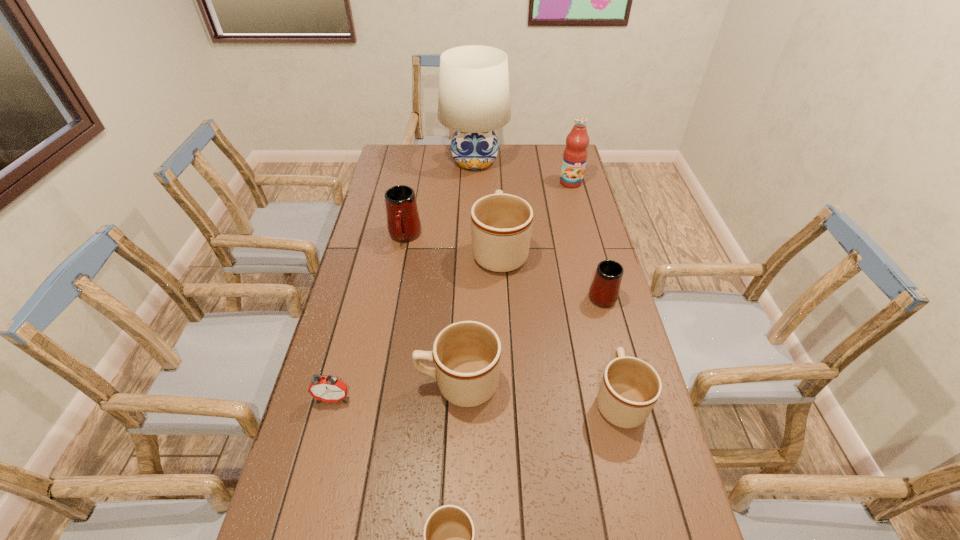
I want to click on alarm clock, so click(x=327, y=389).

Find the location of a particular element. vacant region located on the front-facing side of the tallest object is located at coordinates (474, 220).

In order to click on vacant space located 0.380m on the front label of the second tallest object in this screenshot , I will do `click(588, 248)`.

Find the location of a particular element. Image resolution: width=960 pixels, height=540 pixels. vacant space located on the side of the biggest brown mug with the handle is located at coordinates (498, 207).

The image size is (960, 540). What are the coordinates of `vacant space located 0.240m on the side of the biggest brown mug with the handle` in the screenshot? It's located at (497, 192).

This screenshot has height=540, width=960. In order to click on free spot located on the side of the biggest brown mug with the handle in this screenshot , I will do `click(498, 214)`.

I want to click on vacant area situated on the side of the leftmost mug with the handle, so click(387, 330).

This screenshot has width=960, height=540. I want to click on blank space located on the side of the second biggest brown mug with the handle, so click(325, 383).

Where is `free space located on the side of the second biggest brown mug with the handle`? The image size is (960, 540). free space located on the side of the second biggest brown mug with the handle is located at coordinates (314, 383).

You are a GUI agent. You are given a task and a screenshot of the screen. Output one action in this format:
    pyautogui.click(x=<x>, y=<y>)
    Task: Click on the vacant region located 0.200m on the side of the second biggest brown mug with the handle
    The image size is (960, 540).
    Given the screenshot: What is the action you would take?
    pyautogui.click(x=344, y=383)